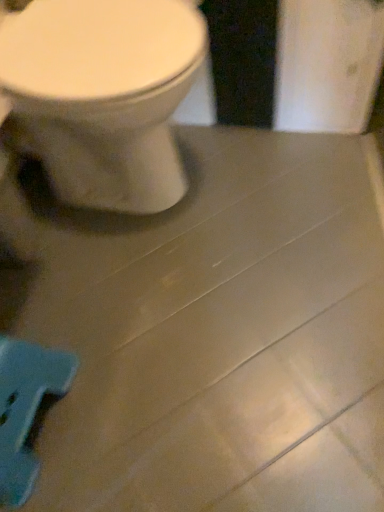
The width and height of the screenshot is (384, 512). I want to click on free space on the front side of white glossy toilet at upper left, so click(x=153, y=308).